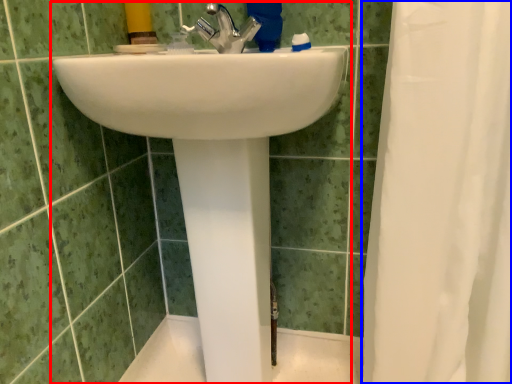
Question: Which point is closer to the camera, sink (highlighted by a red box) or shower curtain (highlighted by a blue box)?

Choices:
 (A) sink
 (B) shower curtain

Answer: (B)